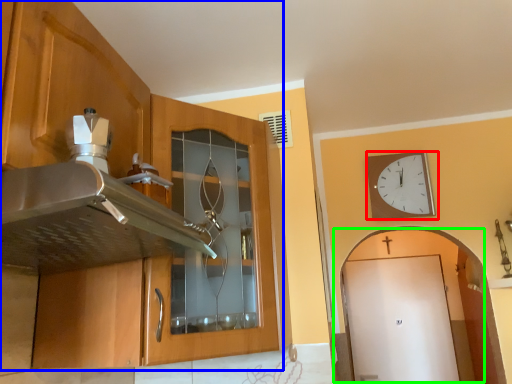
Question: Which is farther away from wall clock (highlighted by a red box)? cabinetry (highlighted by a blue box) or door (highlighted by a green box)?

Choices:
 (A) cabinetry
 (B) door

Answer: (B)